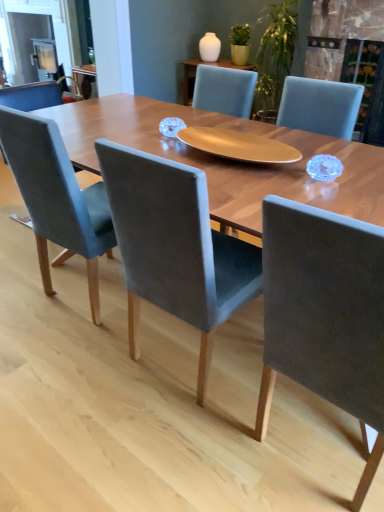
Question: Which direction should I rotate to look at velvet grey chair at center, marked as the second chair in a right-to-left arrangement, — up or down?

Choices:
 (A) down
 (B) up

Answer: (A)

Question: Can we say velvet grey chair at center, marked as the second chair in a left-to-right arrangement, lies outside velvet grey chair at left, acting as the 3th chair starting from the right?

Choices:
 (A) no
 (B) yes

Answer: (B)

Question: Is velvet grey chair at center, marked as the second chair in a left-to-right arrangement, far away from velvet grey chair at left, the 1th chair when ordered from left to right?

Choices:
 (A) no
 (B) yes

Answer: (A)

Question: From the image's perspective, would you say velvet grey chair at center, marked as the second chair in a right-to-left arrangement, is positioned over velvet grey chair at left, the 1th chair when ordered from left to right?

Choices:
 (A) no
 (B) yes

Answer: (A)

Question: Is velvet grey chair at center, marked as the second chair in a right-to-left arrangement, to the left of velvet grey chair at left, the 1th chair when ordered from left to right, from the viewer's perspective?

Choices:
 (A) yes
 (B) no

Answer: (B)

Question: From the image's perspective, is velvet grey chair at center, marked as the second chair in a right-to-left arrangement, under velvet grey chair at left, acting as the 3th chair starting from the right?

Choices:
 (A) yes
 (B) no

Answer: (A)

Question: From a real-world perspective, is velvet grey chair at center, marked as the second chair in a left-to-right arrangement, below velvet grey chair at left, the 1th chair when ordered from left to right?

Choices:
 (A) yes
 (B) no

Answer: (B)

Question: From a real-world perspective, is velvet grey chair at left, the 1th chair when ordered from left to right, under velvet grey chair at center, marked as the second chair in a left-to-right arrangement?

Choices:
 (A) yes
 (B) no

Answer: (A)

Question: Is the depth of velvet grey chair at left, the 1th chair when ordered from left to right, less than that of velvet grey chair at center, marked as the second chair in a right-to-left arrangement?

Choices:
 (A) no
 (B) yes

Answer: (A)

Question: Is velvet grey chair at left, the 1th chair when ordered from left to right, facing away from velvet grey chair at center, marked as the second chair in a left-to-right arrangement?

Choices:
 (A) yes
 (B) no

Answer: (B)

Question: Does velvet grey chair at left, the 1th chair when ordered from left to right, have a greater height compared to velvet grey chair at center, marked as the second chair in a left-to-right arrangement?

Choices:
 (A) yes
 (B) no

Answer: (A)

Question: Is velvet grey chair at left, the 1th chair when ordered from left to right, further to camera compared to velvet grey chair at center, marked as the second chair in a right-to-left arrangement?

Choices:
 (A) yes
 (B) no

Answer: (A)

Question: From the image's perspective, does velvet grey chair at left, acting as the 3th chair starting from the right, appear lower than velvet grey chair at center, marked as the second chair in a left-to-right arrangement?

Choices:
 (A) yes
 (B) no

Answer: (B)

Question: From the image's perspective, would you say suede-like gray chair at center, the 1th chair in the right-to-left sequence, is shown under velvet grey chair at left, acting as the 3th chair starting from the right?

Choices:
 (A) yes
 (B) no

Answer: (A)